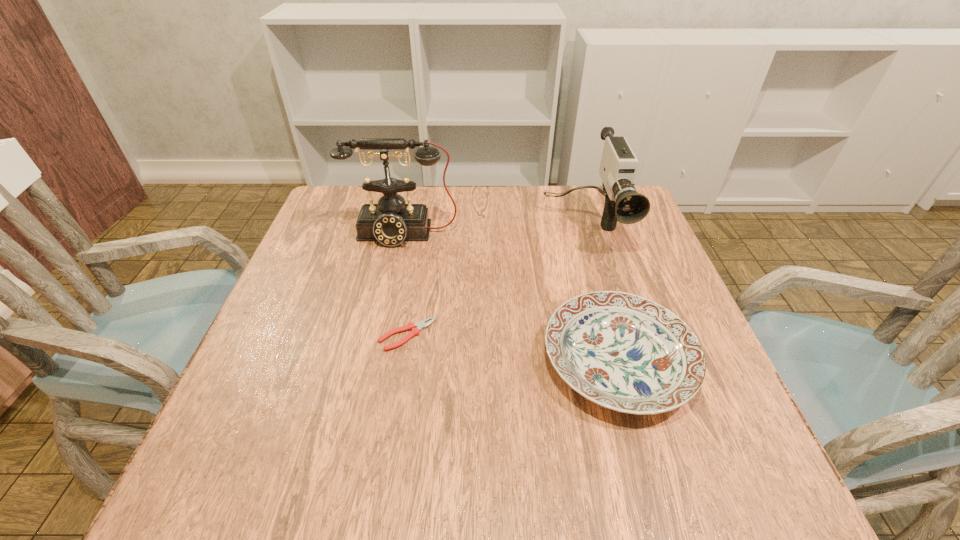
You are a GUI agent. You are given a task and a screenshot of the screen. Output one action in this format:
    pyautogui.click(x=<x>, y=<y>)
    Task: Click on the object that is the closest one to the camcorder
    Image resolution: width=960 pixels, height=540 pixels.
    Given the screenshot: What is the action you would take?
    pyautogui.click(x=624, y=352)